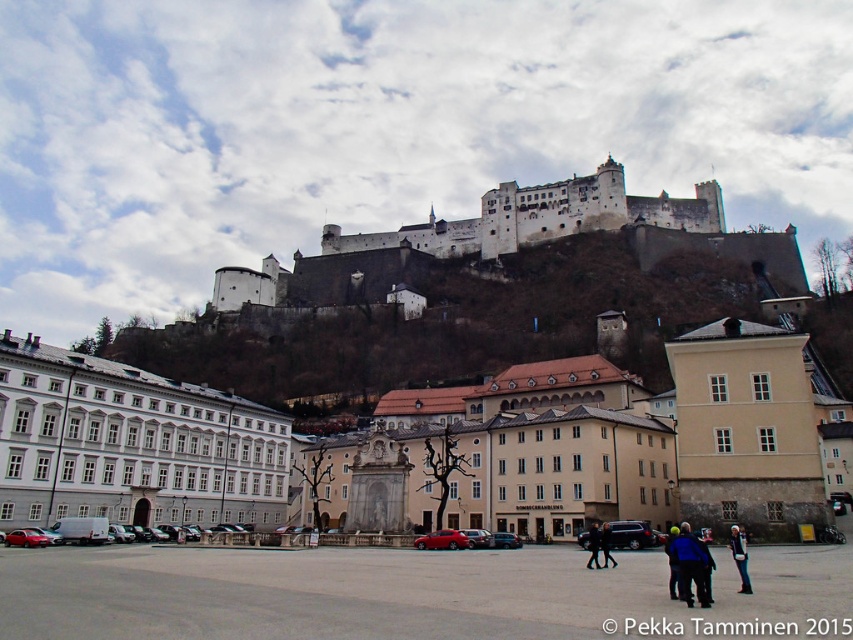
Question: Does blue fabric jacket at lower right appear on the left side of black leather jacket at lower center?

Choices:
 (A) yes
 (B) no

Answer: (B)

Question: Which of the following is the closest to the observer?

Choices:
 (A) (701, 593)
 (B) (592, 564)

Answer: (A)

Question: Which of the following is the closest to the observer?

Choices:
 (A) black leather jacket at lower center
 (B) blue fabric jacket at lower right
 (C) white stone castle at upper center
 (D) dark blue jacket at center

Answer: (D)

Question: Is dark blue jacket at center positioned behind black leather jacket at lower center?

Choices:
 (A) no
 (B) yes

Answer: (A)

Question: Which is nearer to the blue fabric jacket at lower right?

Choices:
 (A) black leather jacket at lower center
 (B) dark blue jacket at center

Answer: (B)

Question: Does dark blue jacket at center appear on the left side of blue fabric jacket at lower right?

Choices:
 (A) yes
 (B) no

Answer: (A)